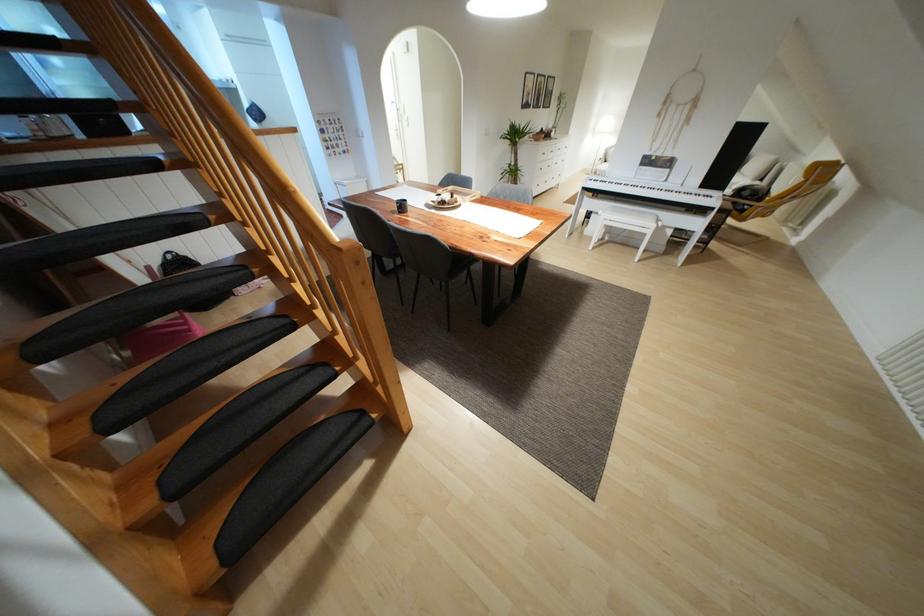
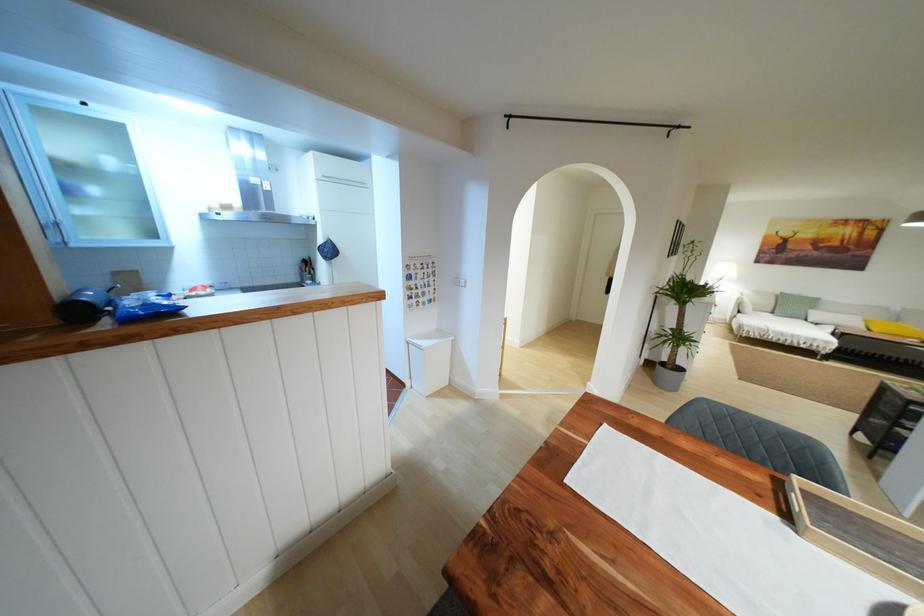
The point at (358, 177) is marked in the first image. Where is the corresponding point in the second image?

(439, 331)